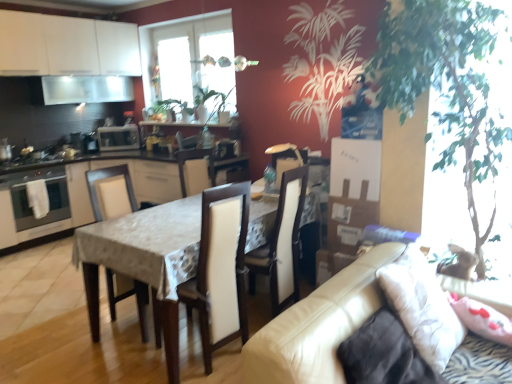
Image resolution: width=512 pixels, height=384 pixels. Identify the location of blank space to the left of white fabric chair at center, arranged as the 1th chair when viewed from the left. (69, 332).